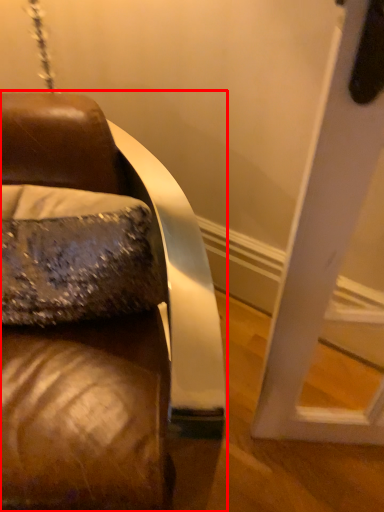
Question: From the image's perspective, considering the relative positions of furniture (annotated by the red box) and throw pillow in the image provided, where is furniture (annotated by the red box) located with respect to the staircase?

Choices:
 (A) below
 (B) above

Answer: (A)